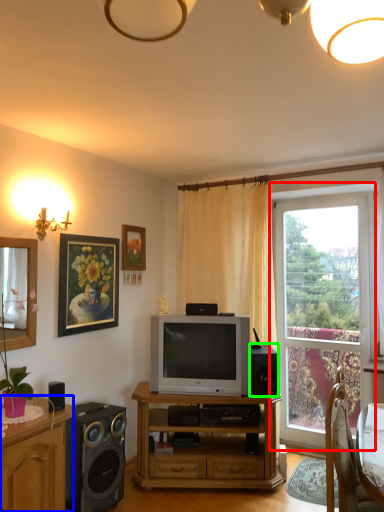
Question: Based on their relative distances, which object is nearer to window (highlighted by a red box)? Choose from cabinetry (highlighted by a blue box) and speaker (highlighted by a green box).

Choices:
 (A) cabinetry
 (B) speaker

Answer: (B)